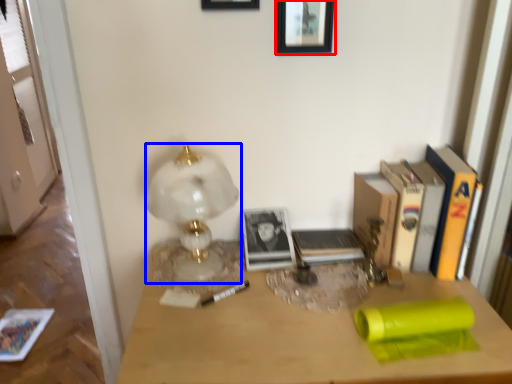
Question: Which object appears closest to the camera in this image, picture frame (highlighted by a red box) or lamp (highlighted by a blue box)?

Choices:
 (A) picture frame
 (B) lamp

Answer: (B)